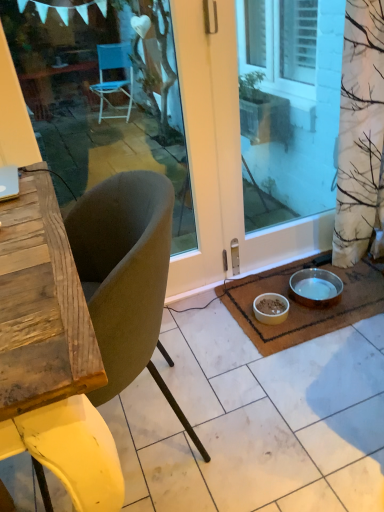
Locate an element on the screen. This screenshot has height=512, width=384. free spot above metallic silver bowl at lower right, marked as the second bowl in a left-to-right arrangement (from a real-world perspective) is located at coordinates (319, 286).